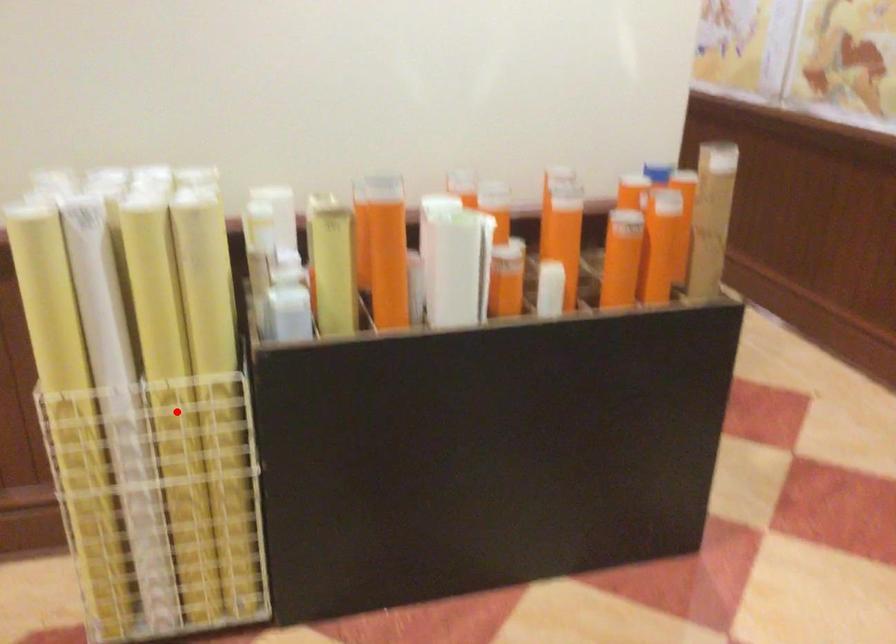
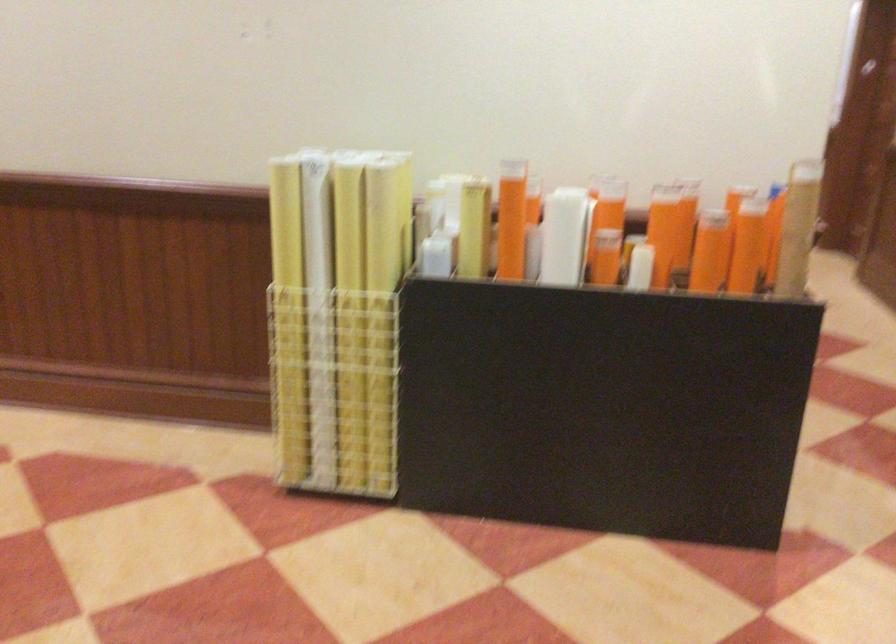
Question: I am providing you with two images of the same scene from different viewpoints. Given a red point in image1, look at the same physical point in image2. Is it:

Choices:
 (A) Closer to the viewpoint
 (B) Farther from the viewpoint

Answer: (B)